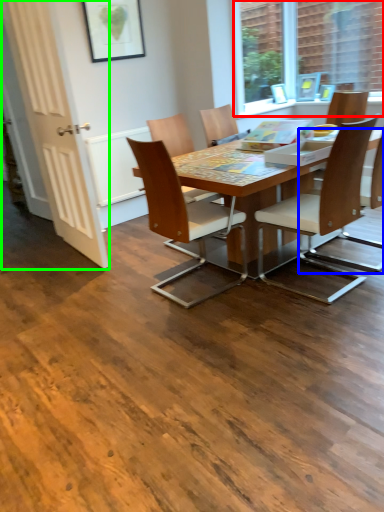
Question: Estimate the real-world distances between objects in this image. Which object is closer to window (highlighted by a red box), chair (highlighted by a blue box) or screen door (highlighted by a green box)?

Choices:
 (A) chair
 (B) screen door

Answer: (A)